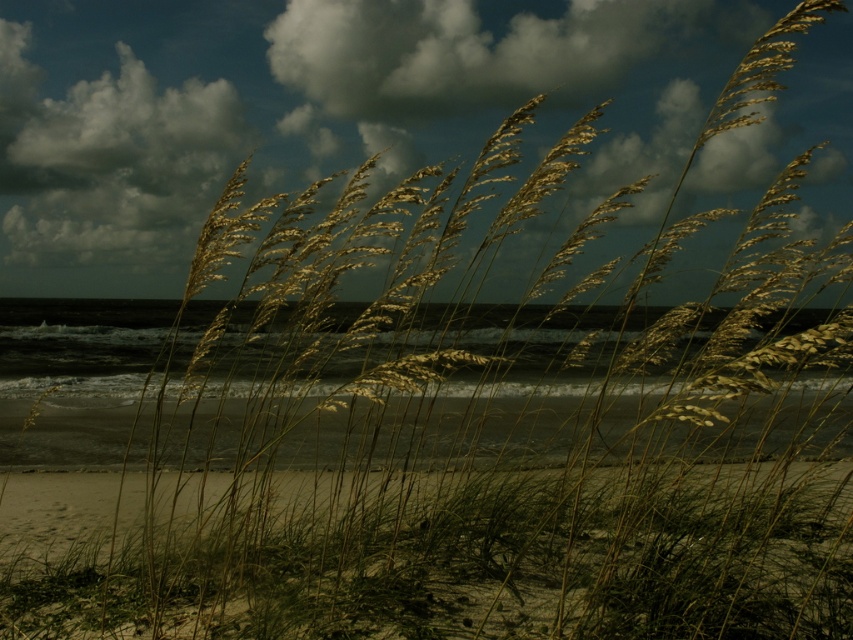
You are standing on the beach and want to take a photo of the cloudy sky at upper center and the smooth sand at lower center. Which object should you point your camera towards first if you want to capture both in one shot?

You should point your camera towards the cloudy sky at upper center first because it is located to the left of the smooth sand at lower center, so capturing it first will ensure both are in frame.

You are a photographer standing at the edge of the beach. You want to take a photo of both the golden grasses and the ocean. You notice two points marked in the scene. One is at point (358, 80) and the other at point (96, 536). Which point should you focus on to ensure both the golden grasses and the ocean are in focus?

You should focus on point (358, 80) because it is closer to the camera than point (96, 536). This will ensure that both the foreground golden grasses and the background ocean remain in focus.

You are a photographer standing at the edge of the beach, holding a camera. You want to take a photo that includes both the golden grasses in the foreground and the cloudy sky at upper center. The camera has a depth of field that can focus clearly on objects within a 4 meter range. Will both the grasses and the cloudy sky be in focus in the photo?

The cloudy sky at upper center is 5.31 meters from the camera, which is beyond the 4 meter depth of field range. Therefore, the cloudy sky will be out of focus while the golden grasses in the foreground are within the focus range and will be sharp.